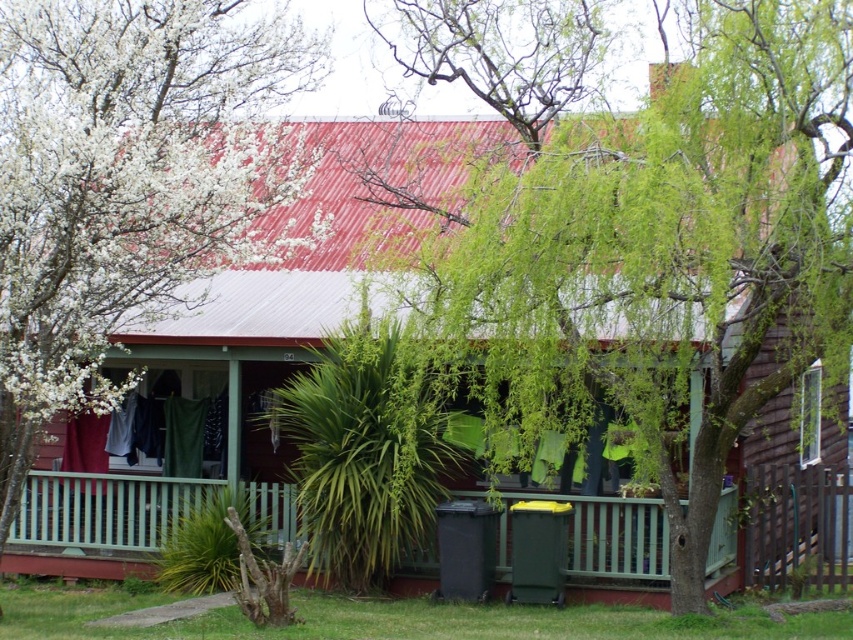
Between green leafy tree at center and white blossoming branches at upper left, which one has less height?

white blossoming branches at upper left is shorter.

Is green leafy tree at center positioned before white blossoming branches at upper left?

Yes.

What do you see at coordinates (643, 224) in the screenshot? I see `green leafy tree at center` at bounding box center [643, 224].

Locate an element on the screen. This screenshot has height=640, width=853. green leafy tree at center is located at coordinates (643, 224).

Measure the distance between point (21, 477) and camera.

13.39 meters

Can you confirm if white blossoming branches at upper left is shorter than green wooden porch at center?

No, white blossoming branches at upper left is not shorter than green wooden porch at center.

The width and height of the screenshot is (853, 640). In order to click on white blossoming branches at upper left in this screenshot , I will do `click(128, 184)`.

Locate an element on the screen. This screenshot has height=640, width=853. white blossoming branches at upper left is located at coordinates (128, 184).

Who is positioned more to the right, green leafy tree at center or green wooden porch at center?

Positioned to the right is green leafy tree at center.

Between point (817, 317) and point (718, 524), which one is positioned behind?

Positioned behind is point (718, 524).

You are a GUI agent. You are given a task and a screenshot of the screen. Output one action in this format:
    pyautogui.click(x=<x>, y=<y>)
    Task: Click on the green leafy tree at center
    
    Given the screenshot: What is the action you would take?
    pyautogui.click(x=643, y=224)